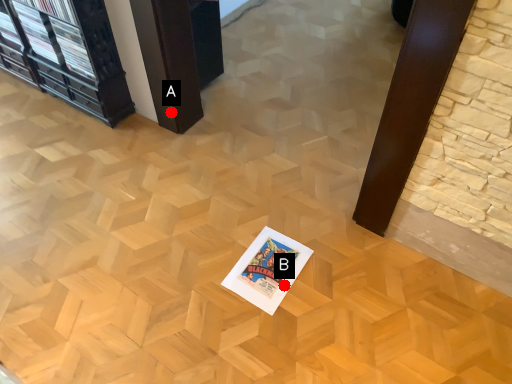
Question: Two points are circled on the image, labeled by A and B beside each circle. Which point is closer to the camera?

Choices:
 (A) A is closer
 (B) B is closer

Answer: (B)